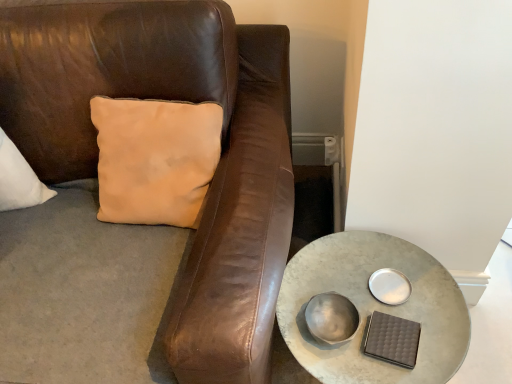
The image size is (512, 384). What are the coordinates of `free space to the back side of metallic silver bowl at lower center` in the screenshot? It's located at tap(332, 265).